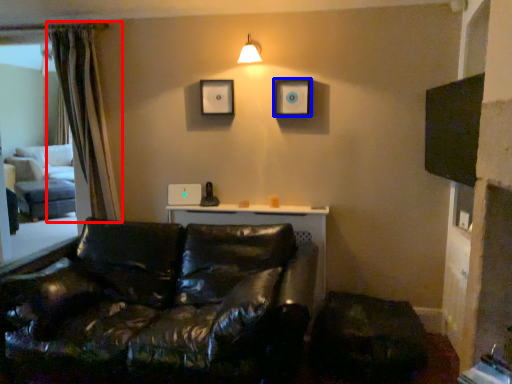
Question: Which object is further to the camera taking this photo, curtain (highlighted by a red box) or picture frame (highlighted by a blue box)?

Choices:
 (A) curtain
 (B) picture frame

Answer: (B)